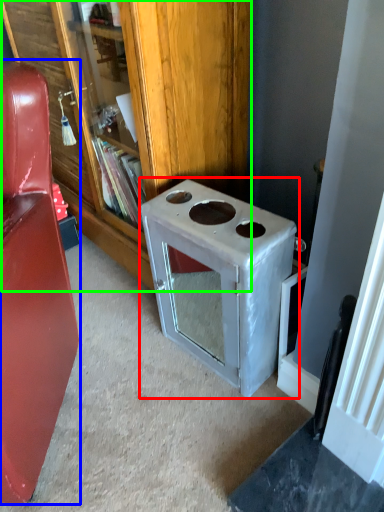
Question: Estimate the real-world distances between objects in this image. Which object is farther from appliance (highlighted by a red box), furniture (highlighted by a blue box) or bookcase (highlighted by a green box)?

Choices:
 (A) furniture
 (B) bookcase

Answer: (A)